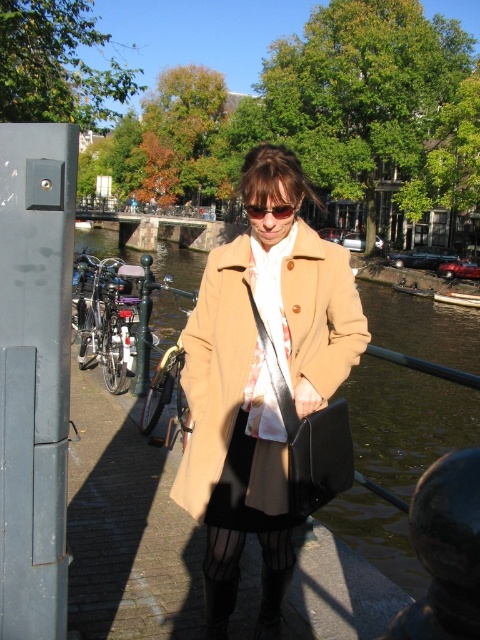
You are a tourist visiting the canal and see the clear water at center and the clear plastic goggles at center. Which object is positioned higher from the ground?

The clear water at center is located above the clear plastic goggles at center, so the clear water at center is higher from the ground.

You are a tailor who needs to determine which item, the beige wool coat at center or the clear plastic goggles at center, requires more vertical storage space. Based on the scene, which item should be placed in a taller storage compartment?

The clear plastic goggles at center are taller than the beige wool coat at center, so they should be placed in a taller storage compartment.

Looking at this image, you are a tourist in the city and want to take a photo of both the point at (402, 424) and the point at (295, 204). Which point should you focus on first to ensure both are in the frame?

You should focus on the point at (295, 204) first because it is in front of the point at (402, 424), so you can frame both by adjusting the camera to include the background point as well.